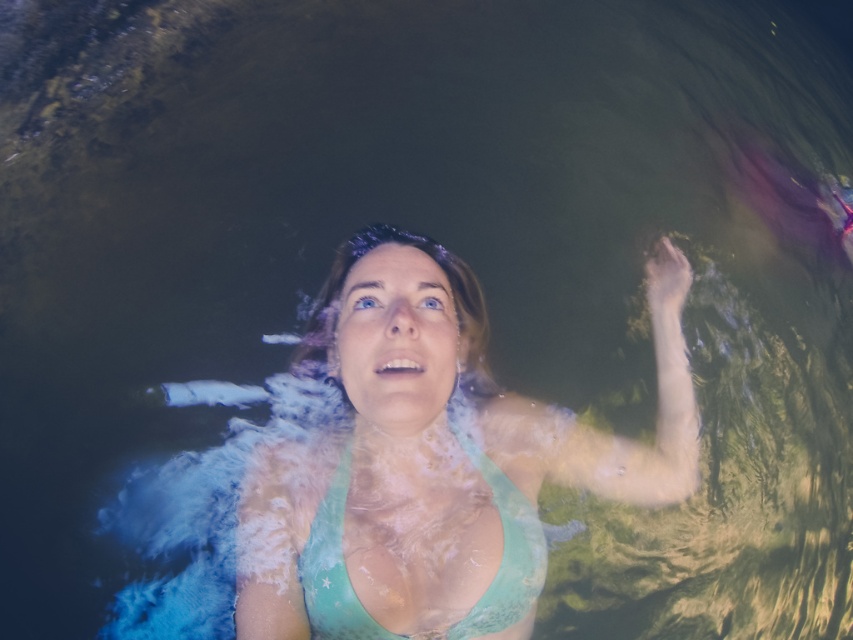
Does teal lace bikini top at center lie in front of teal fabric bikini top at center?

Yes.

Is teal lace bikini top at center to the left of teal fabric bikini top at center from the viewer's perspective?

Incorrect, teal lace bikini top at center is not on the left side of teal fabric bikini top at center.

Between point (410, 356) and point (532, 602), which one is positioned in front?

Point (410, 356) is more forward.

In order to click on teal lace bikini top at center in this screenshot , I will do `click(434, 460)`.